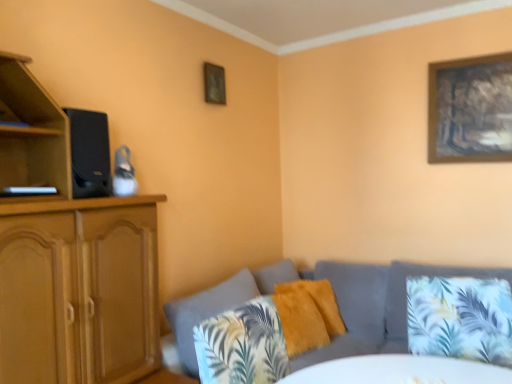
Question: Considering the positions of textured gray couch at lower right and fuzzy yellow pillow at center, which is the first pillow in back-to-front order, in the image, is textured gray couch at lower right taller or shorter than fuzzy yellow pillow at center, which is the first pillow in back-to-front order,?

Choices:
 (A) tall
 (B) short

Answer: (A)

Question: From the image's perspective, is textured gray couch at lower right positioned above or below fuzzy yellow pillow at center, which is the first pillow in back-to-front order?

Choices:
 (A) below
 (B) above

Answer: (A)

Question: Which is nearer to the fluffy orange pillow at center, marked as the second pillow in a front-to-back arrangement?

Choices:
 (A) printed fabric pillow at lower right, the 1th pillow from the front
 (B) wooden framed artwork at upper right, arranged as the second picture frame when viewed from the left
 (C) fuzzy yellow pillow at center, which is the first pillow in back-to-front order
 (D) black matte speaker at left
 (E) textured gray couch at lower right

Answer: (C)

Question: Considering the real-world distances, which object is farthest from the fluffy orange pillow at center, marked as the second pillow in a front-to-back arrangement?

Choices:
 (A) wooden framed artwork at upper right, which is the 1th picture frame in right-to-left order
 (B) textured gray couch at lower right
 (C) black matte speaker at left
 (D) printed fabric pillow at lower right, the 1th pillow from the front
 (E) wooden picture frame at upper center, placed as the second picture frame when sorted from right to left

Answer: (A)